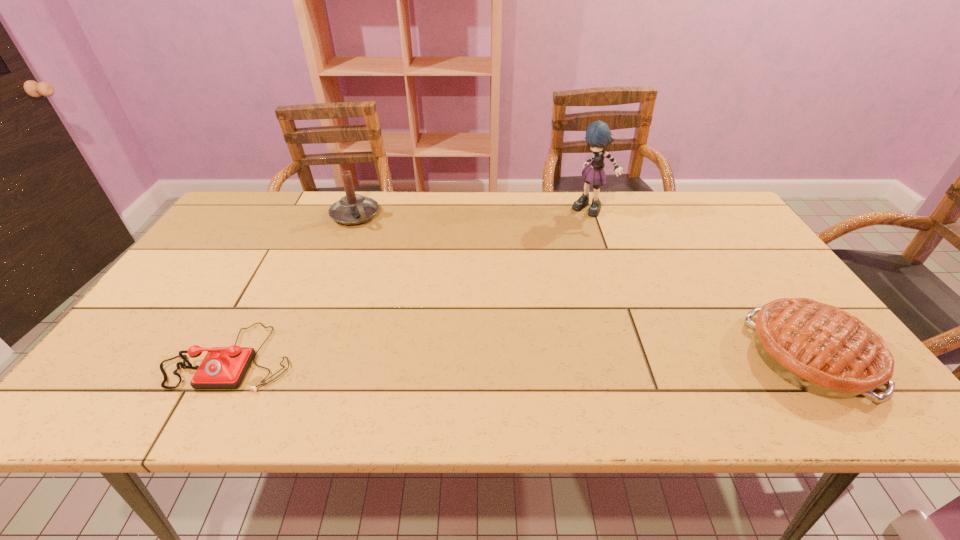
Where is `vacant area that lies between the shortest object and the tallest object`? The width and height of the screenshot is (960, 540). vacant area that lies between the shortest object and the tallest object is located at coordinates [x=412, y=284].

Where is `vacant space in between the rag doll and the rightmost object`? The width and height of the screenshot is (960, 540). vacant space in between the rag doll and the rightmost object is located at coordinates (700, 283).

In order to click on free space between the third shortest object and the tallest object in this screenshot , I will do `click(473, 212)`.

This screenshot has height=540, width=960. What are the coordinates of `empty space that is in between the pie and the rag doll` in the screenshot? It's located at (700, 283).

Find the location of a particular element. This screenshot has height=540, width=960. free space between the pie and the third shortest object is located at coordinates (582, 286).

This screenshot has width=960, height=540. Identify the location of free point between the pie and the second object from right to left. (700, 283).

At what (x,y) coordinates should I click in order to perform the action: click on empty space between the tallest object and the shortest object. Please return your answer as a coordinate pair (x, y). Looking at the image, I should click on (412, 284).

Locate an element on the screen. the closest object to the rightmost object is located at coordinates (598, 135).

Identify the location of object that is the third closest to the pie. (223, 367).

Locate an element on the screen. vacant region that satisfies the following two spatial constraints: 1. on the front side of the rightmost object; 2. on the left side of the tallest object is located at coordinates (642, 356).